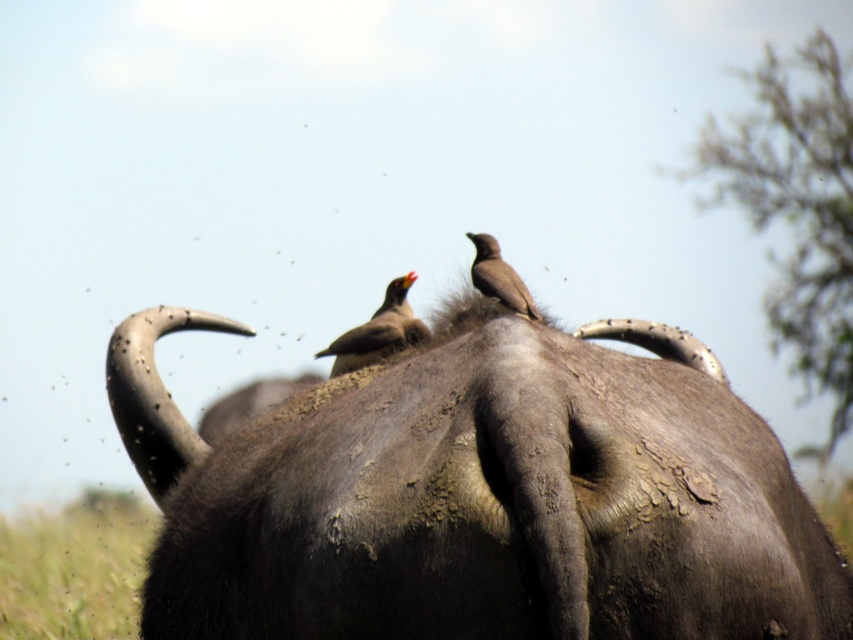
You are a photographer trying to capture the dark gray textured hide at center in the image. Based on its position, where would you aim your camera to ensure it is centered in your shot?

You should aim your camera at the coordinates point (479, 497) to center the dark gray textured hide at center in your shot.

You are a photographer trying to capture a photo of the dark gray textured hide at center and the green grass at bottom left in the image. Based on their positions, which object should you focus on first if you want to include both in the same frame without moving the camera?

The dark gray textured hide at center is to the right of the green grass at bottom left, so you should focus on the green grass at bottom left first to ensure both are in the frame.